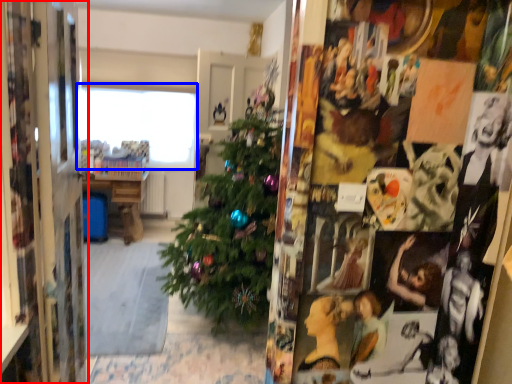
Question: Which object is further to the camera taking this photo, collage (highlighted by a red box) or window (highlighted by a blue box)?

Choices:
 (A) collage
 (B) window

Answer: (B)